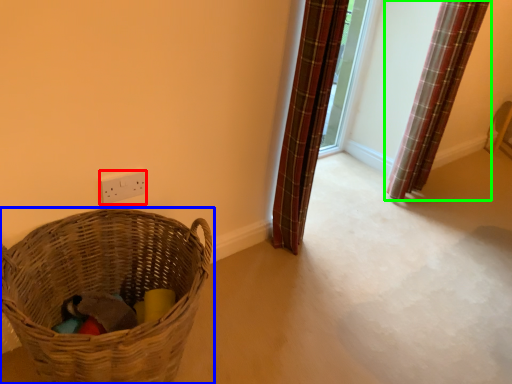
Question: Which is nearer to the electric outlet (highlighted by a red box)? picnic basket (highlighted by a blue box) or curtain (highlighted by a green box).

Choices:
 (A) picnic basket
 (B) curtain

Answer: (A)